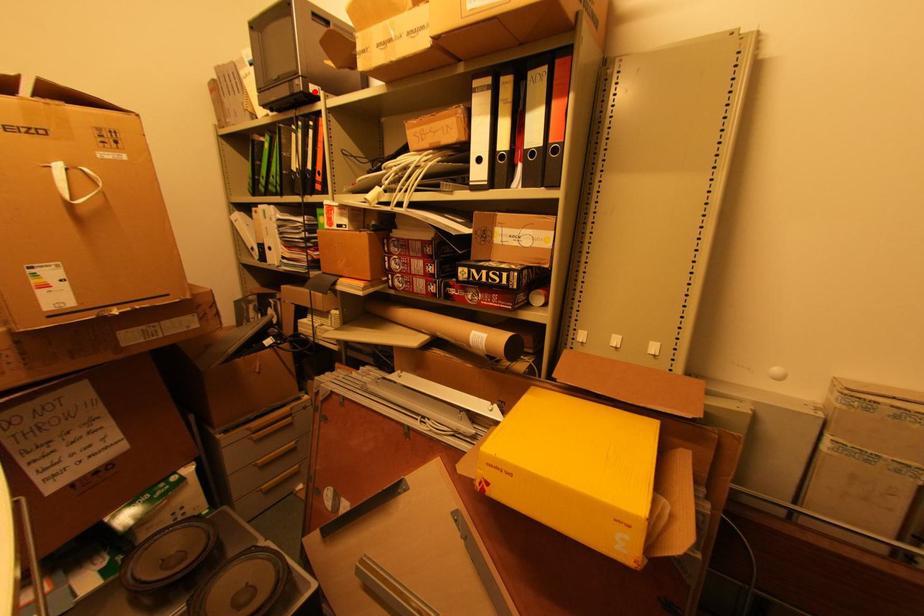
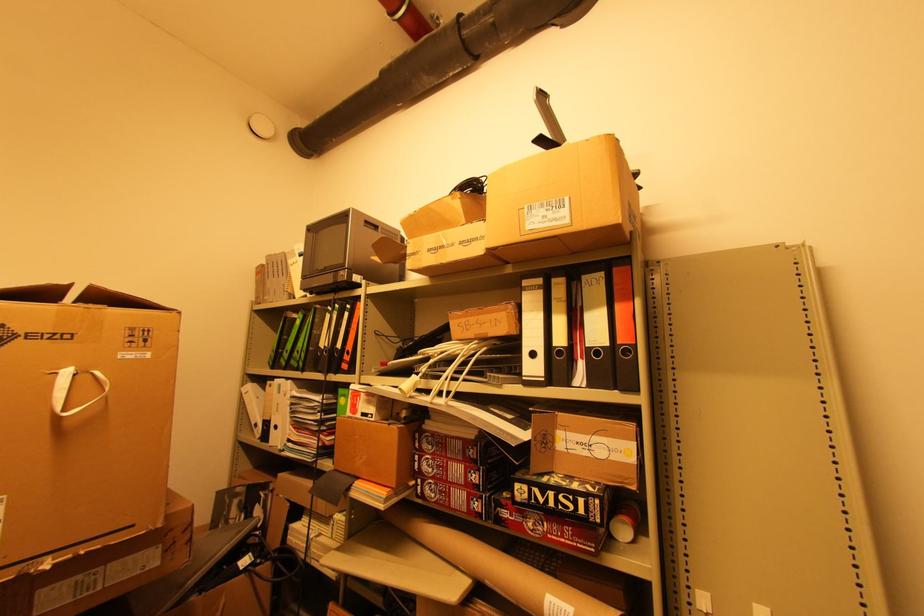
Find the pixel in the second image that matches the highlighted location in the first image.

(358, 281)